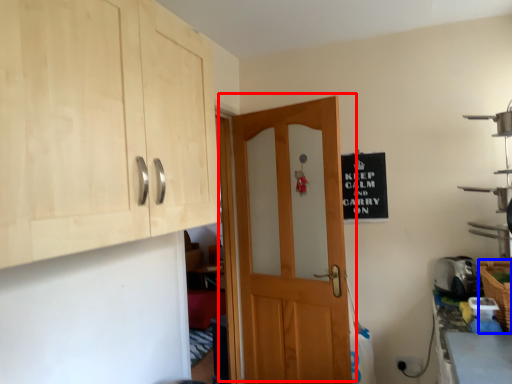
Question: Which object is closer to the camera taking this photo, door (highlighted by a red box) or basket (highlighted by a blue box)?

Choices:
 (A) door
 (B) basket

Answer: (B)